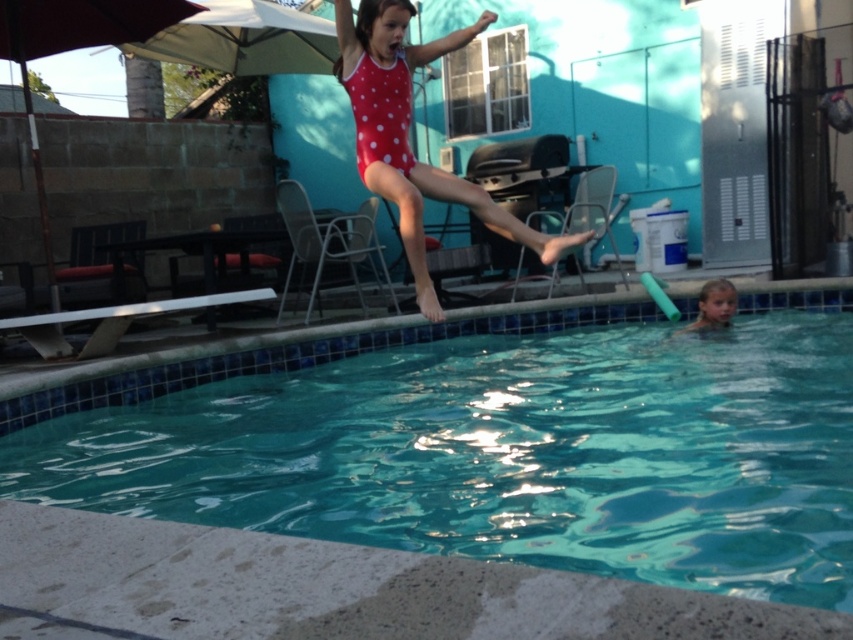
Who is shorter, red fabric umbrella at upper left or smooth skin child at lower right?

With less height is smooth skin child at lower right.

Which is in front, point (38, 172) or point (712, 296)?

Point (712, 296)

The height and width of the screenshot is (640, 853). I want to click on red fabric umbrella at upper left, so click(74, 49).

Is teal glossy water at center to the right of red fabric umbrella at upper left from the viewer's perspective?

Correct, you'll find teal glossy water at center to the right of red fabric umbrella at upper left.

Is teal glossy water at center in front of red fabric umbrella at upper left?

Yes, teal glossy water at center is closer to the viewer.

Is point (166, 410) farther from camera compared to point (38, 150)?

No, (166, 410) is closer to viewer.

Where is `teal glossy water at center`? teal glossy water at center is located at coordinates (494, 442).

Who is shorter, red polka dot swimsuit at upper center or smooth skin child at lower right?

With less height is smooth skin child at lower right.

Is red polka dot swimsuit at upper center wider than smooth skin child at lower right?

Yes.

Who is more forward, (x=341, y=64) or (x=727, y=280)?

Point (x=341, y=64) is more forward.

You are a GUI agent. You are given a task and a screenshot of the screen. Output one action in this format:
    pyautogui.click(x=<x>, y=<y>)
    Task: Click on the red polka dot swimsuit at upper center
    The width and height of the screenshot is (853, 640).
    Given the screenshot: What is the action you would take?
    pyautogui.click(x=407, y=134)